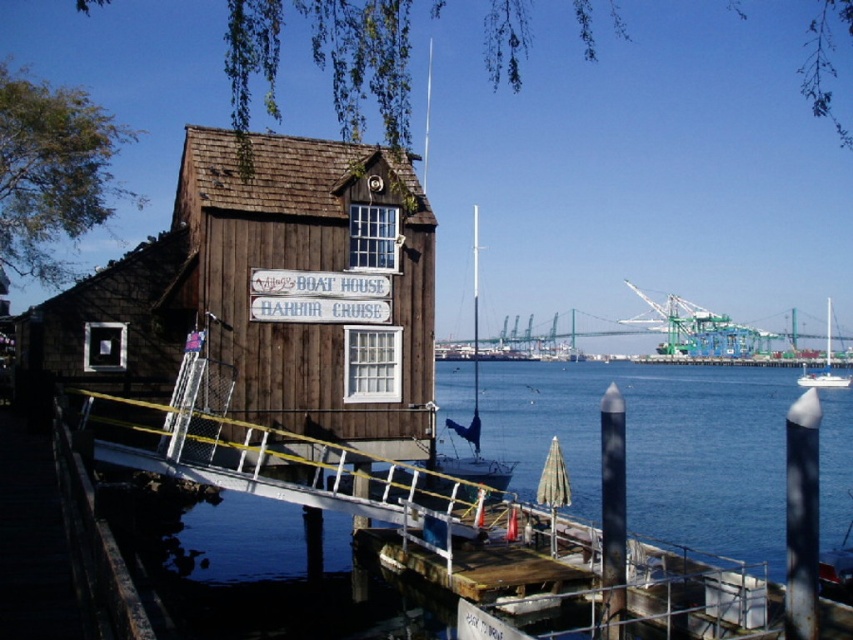
Is blue water at lower center to the right of white glossy sailboat at right from the viewer's perspective?

Incorrect, blue water at lower center is not on the right side of white glossy sailboat at right.

Does blue water at lower center appear under white glossy sailboat at right?

Yes.

Based on the photo, measure the distance between blue water at lower center and camera.

blue water at lower center and camera are 21.98 meters apart from each other.

The image size is (853, 640). What are the coordinates of `blue water at lower center` in the screenshot? It's located at (654, 445).

Is point (621, 401) farther from viewer compared to point (502, 486)?

No, it is in front of (502, 486).

I want to click on white wooden dock at lower center, so click(x=497, y=525).

Find the location of a particular element. white wooden dock at lower center is located at coordinates (497, 525).

At what (x,y) coordinates should I click in order to perform the action: click on white wooden dock at lower center. Please return your answer as a coordinate pair (x, y). The width and height of the screenshot is (853, 640). Looking at the image, I should click on (497, 525).

Between point (320, 230) and point (471, 467), which one is positioned in front?

Point (320, 230)

What do you see at coordinates (268, 292) in the screenshot?
I see `dark brown wood boat house at center` at bounding box center [268, 292].

You are a GUI agent. You are given a task and a screenshot of the screen. Output one action in this format:
    pyautogui.click(x=<x>, y=<y>)
    Task: Click on the dark brown wood boat house at center
    The height and width of the screenshot is (640, 853).
    Given the screenshot: What is the action you would take?
    pyautogui.click(x=268, y=292)

Locate an element on the screen. Image resolution: width=853 pixels, height=640 pixels. dark brown wood boat house at center is located at coordinates (268, 292).